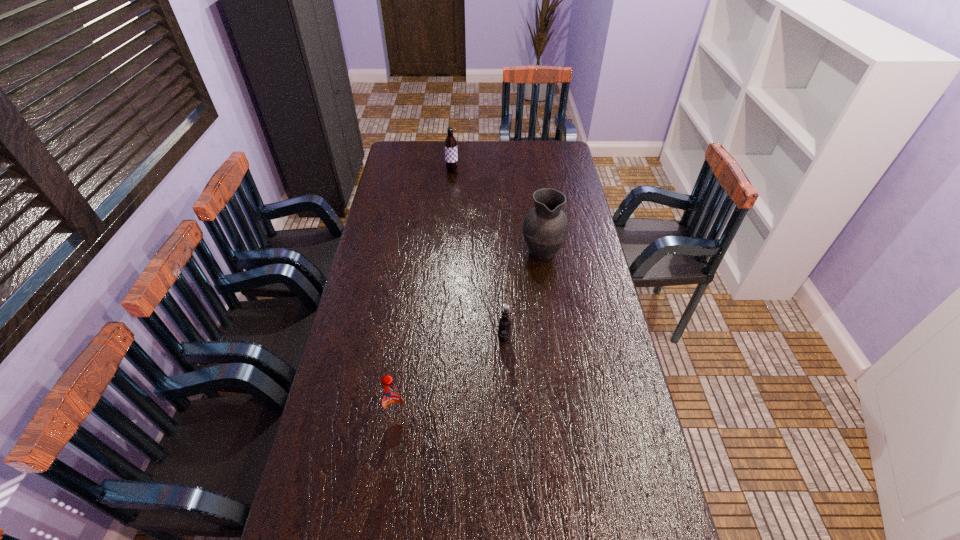
Where is `the rightmost object`? This screenshot has height=540, width=960. the rightmost object is located at coordinates (545, 228).

What are the coordinates of `the third nearest object` in the screenshot? It's located at (545, 228).

Identify the location of the second object from left to right. The height and width of the screenshot is (540, 960). (x=451, y=155).

This screenshot has width=960, height=540. Find the location of `the second root beer from left to right`. the second root beer from left to right is located at coordinates (451, 155).

Where is `the leftmost object`? The image size is (960, 540). the leftmost object is located at coordinates (393, 404).

Find the location of `the leftmost root beer`. the leftmost root beer is located at coordinates (393, 404).

Where is `the second farthest root beer`? This screenshot has width=960, height=540. the second farthest root beer is located at coordinates click(x=504, y=325).

Locate an element on the screen. the third farthest object is located at coordinates (504, 325).

What are the coordinates of `vacant position located 0.070m on the side of the tallest object with the handle` in the screenshot? It's located at point(539,225).

Locate an element on the screen. This screenshot has width=960, height=540. vacant space located on the side of the tallest object with the handle is located at coordinates (535, 201).